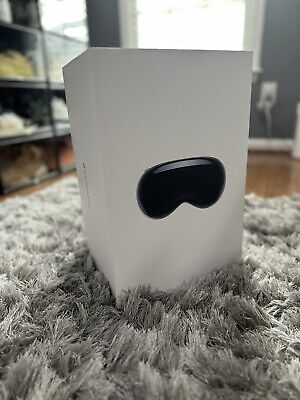
What are the coordinates of `windows` in the screenshot? It's located at (179, 15), (60, 13).